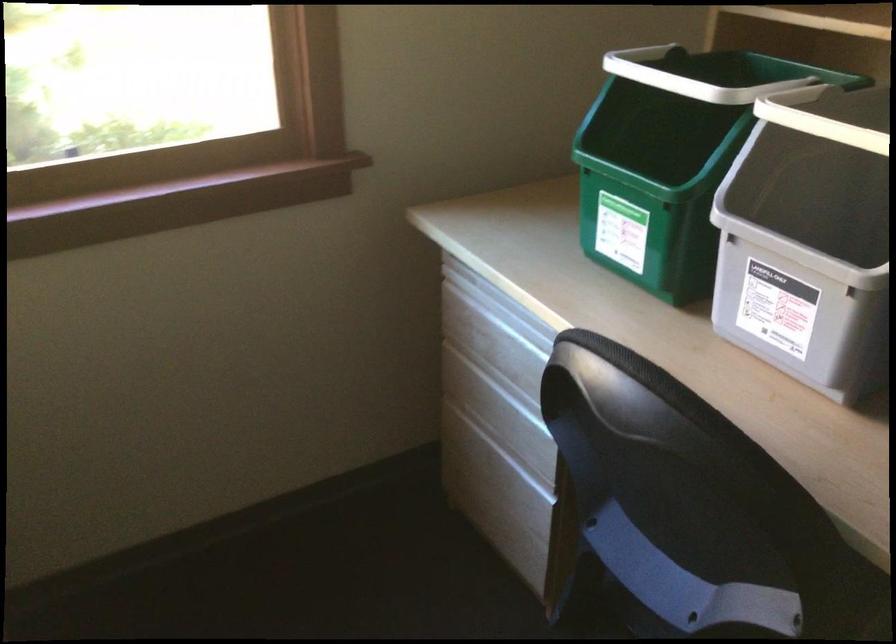
Find the location of `grey bin rim`. grey bin rim is located at coordinates (652, 194).